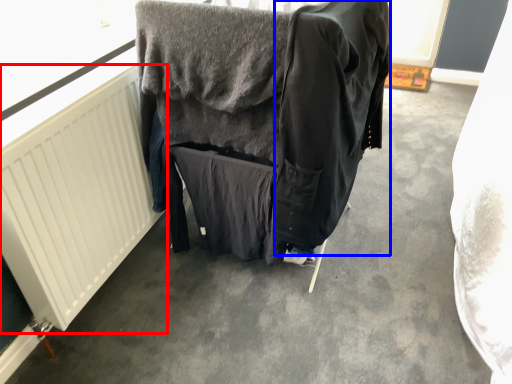
Question: Which object is closer to the camera taking this photo, radiator (highlighted by a red box) or clothing (highlighted by a blue box)?

Choices:
 (A) radiator
 (B) clothing

Answer: (B)